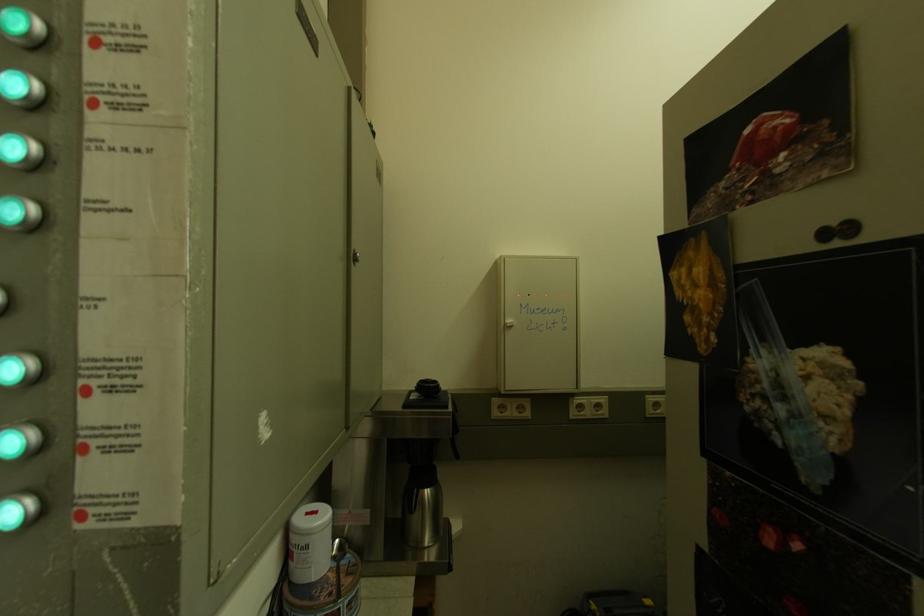
You are a GUI agent. You are given a task and a screenshot of the screen. Output one action in this format:
    pyautogui.click(x=<x>, y=<y>)
    Task: Click on the silver cabinet lock
    This screenshot has width=924, height=616.
    Given the screenshot: What is the action you would take?
    pyautogui.click(x=355, y=257)